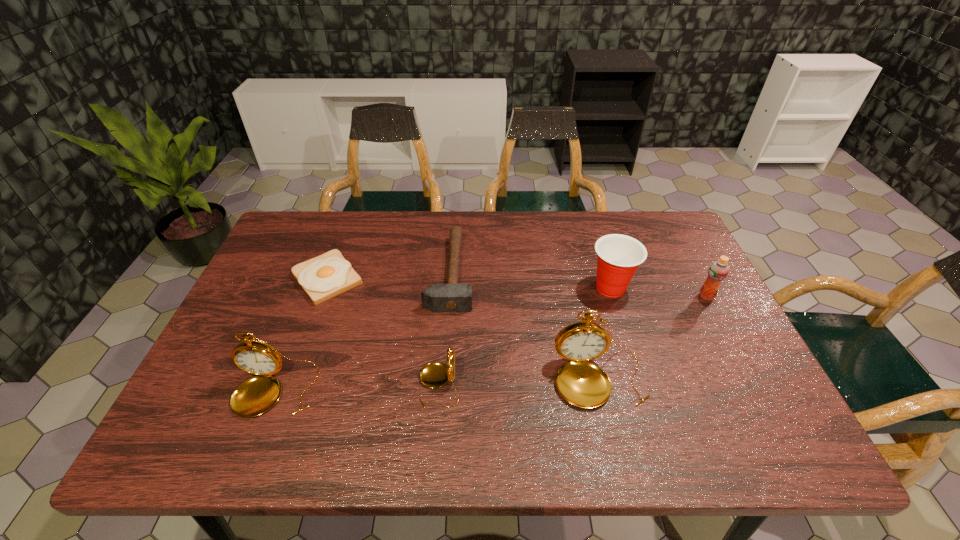
Given the evenly spaced pocket watchs in the image, where should an extra pocket watch be added on the right to preserve the spacing? Please point to a vacant space. Please provide its 2D coordinates. Your answer should be formatted as a tuple, i.e. [(x, y)], where the tuple contains the x and y coordinates of a point satisfying the conditions above.

[(756, 373)]